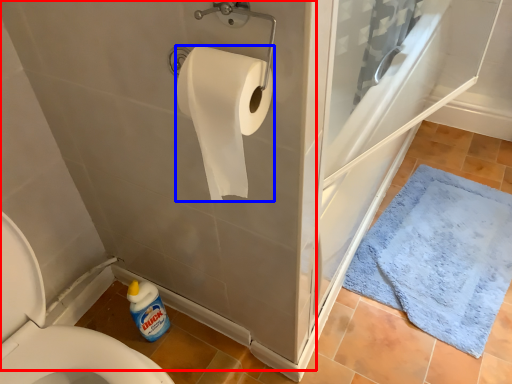
Question: Which object is further to the camera taking this photo, bath (highlighted by a red box) or toilet paper (highlighted by a blue box)?

Choices:
 (A) bath
 (B) toilet paper

Answer: (B)